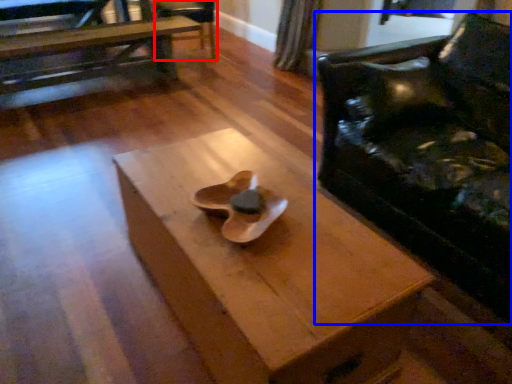
Question: Among these objects, which one is farthest to the camera, armchair (highlighted by a red box) or chair (highlighted by a blue box)?

Choices:
 (A) armchair
 (B) chair

Answer: (A)